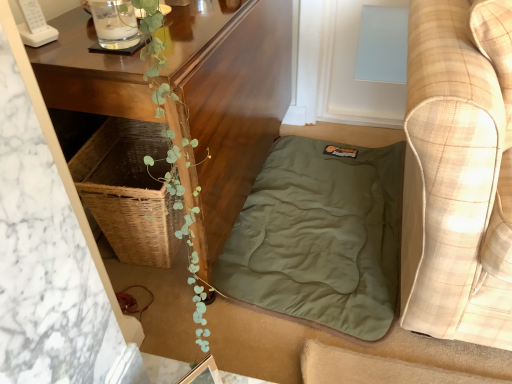
Question: Is plaid fabric couch at right further to the viewer compared to wooden table at center?

Choices:
 (A) yes
 (B) no

Answer: (B)

Question: Does plaid fabric couch at right have a lesser height compared to wooden table at center?

Choices:
 (A) no
 (B) yes

Answer: (A)

Question: From the image's perspective, is plaid fabric couch at right over wooden table at center?

Choices:
 (A) yes
 (B) no

Answer: (B)

Question: Does plaid fabric couch at right appear on the right side of wooden table at center?

Choices:
 (A) no
 (B) yes

Answer: (B)

Question: Would you say plaid fabric couch at right is a long distance from wooden table at center?

Choices:
 (A) no
 (B) yes

Answer: (A)

Question: Is wooden table at center wider or thinner than plaid fabric couch at right?

Choices:
 (A) wide
 (B) thin

Answer: (B)

Question: Considering the relative positions of wooden table at center and plaid fabric couch at right in the image provided, is wooden table at center to the left or to the right of plaid fabric couch at right?

Choices:
 (A) left
 (B) right

Answer: (A)

Question: Does point (263, 11) appear closer or farther from the camera than point (456, 86)?

Choices:
 (A) closer
 (B) farther

Answer: (B)

Question: Is wooden table at center situated inside plaid fabric couch at right or outside?

Choices:
 (A) inside
 (B) outside

Answer: (B)

Question: From a real-world perspective, is wooden table at center above or below olive green fabric at lower center?

Choices:
 (A) below
 (B) above

Answer: (B)

Question: From the image's perspective, relative to olive green fabric at lower center, is wooden table at center above or below?

Choices:
 (A) above
 (B) below

Answer: (A)

Question: Is point (274, 24) positioned closer to the camera than point (353, 306)?

Choices:
 (A) closer
 (B) farther

Answer: (B)

Question: Is wooden table at center bigger or smaller than olive green fabric at lower center?

Choices:
 (A) big
 (B) small

Answer: (A)

Question: Is point (471, 178) closer or farther from the camera than point (67, 102)?

Choices:
 (A) closer
 (B) farther

Answer: (A)

Question: In terms of height, does plaid fabric couch at right look taller or shorter compared to wooden table at center?

Choices:
 (A) tall
 (B) short

Answer: (A)